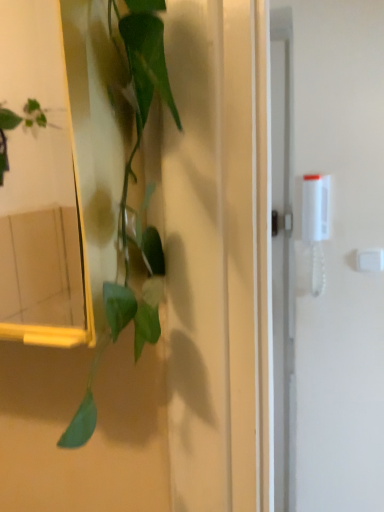
What is the approximate height of green matte plant at left?

The height of green matte plant at left is 16.72 inches.

In order to face green matte plant at left, should I rotate leftwards or rightwards?

You should look left and rotate roughly 7.533 degrees.

Image resolution: width=384 pixels, height=512 pixels. Describe the element at coordinates (143, 71) in the screenshot. I see `green matte plant at left` at that location.

Where is `green matte plant at left`? green matte plant at left is located at coordinates (143, 71).

The width and height of the screenshot is (384, 512). I want to click on white plastic light switch at upper right, so click(x=370, y=260).

Measure the distance between point [377,261] and camera.

Point [377,261] and camera are 4.62 feet apart from each other.

The width and height of the screenshot is (384, 512). Describe the element at coordinates (370, 260) in the screenshot. I see `white plastic light switch at upper right` at that location.

Where is `green matte plant at left`? This screenshot has height=512, width=384. green matte plant at left is located at coordinates (143, 71).

Which object is positioned more to the right, green matte plant at left or white plastic light switch at upper right?

Positioned to the right is white plastic light switch at upper right.

Which object is further away from the camera taking this photo, green matte plant at left or white plastic light switch at upper right?

white plastic light switch at upper right is more distant.

Considering the positions of points (139, 84) and (379, 270), is point (139, 84) farther from camera compared to point (379, 270)?

No, (139, 84) is in front of (379, 270).

From the image's perspective, is green matte plant at left beneath white plastic light switch at upper right?

Incorrect, from the image's perspective, green matte plant at left is higher than white plastic light switch at upper right.

Based on the photo, from a real-world perspective, which object stands above the other?

From a 3D spatial view, green matte plant at left is above.

In terms of width, does green matte plant at left look wider or thinner when compared to white plastic light switch at upper right?

Considering their sizes, green matte plant at left looks broader than white plastic light switch at upper right.

Considering the relative sizes of green matte plant at left and white plastic light switch at upper right in the image provided, is green matte plant at left taller than white plastic light switch at upper right?

Correct, green matte plant at left is much taller as white plastic light switch at upper right.

Can you confirm if green matte plant at left is smaller than white plastic light switch at upper right?

Actually, green matte plant at left might be larger than white plastic light switch at upper right.

Do you think green matte plant at left is within white plastic light switch at upper right, or outside of it?

green matte plant at left is spatially situated outside white plastic light switch at upper right.

Is green matte plant at left next to white plastic light switch at upper right?

No, green matte plant at left is not touching white plastic light switch at upper right.

Is green matte plant at left oriented away from white plastic light switch at upper right?

No, green matte plant at left is not facing away from white plastic light switch at upper right.

How different are the orientations of green matte plant at left and white plastic light switch at upper right in degrees?

There is a 90.6-degree angle between the facing directions of green matte plant at left and white plastic light switch at upper right.

I want to click on houseplant in front of the white plastic light switch at upper right, so click(x=143, y=71).

In the scene shown: Between white plastic light switch at upper right and green matte plant at left, which one appears on the left side from the viewer's perspective?

green matte plant at left is more to the left.

Does white plastic light switch at upper right lie behind green matte plant at left?

Yes, the depth of white plastic light switch at upper right is greater than that of green matte plant at left.

Which point is more forward, (x=370, y=265) or (x=128, y=7)?

The point (x=128, y=7) is closer to the camera.

From the image's perspective, which is below, white plastic light switch at upper right or green matte plant at left?

white plastic light switch at upper right.

From a real-world perspective, relative to green matte plant at left, is white plastic light switch at upper right vertically above or below?

In terms of real-world spatial position, white plastic light switch at upper right is below green matte plant at left.

Between white plastic light switch at upper right and green matte plant at left, which one has smaller width?

white plastic light switch at upper right.

Consider the image. Can you confirm if white plastic light switch at upper right is shorter than green matte plant at left?

Yes, white plastic light switch at upper right is shorter than green matte plant at left.

Which of these two, white plastic light switch at upper right or green matte plant at left, is bigger?

With larger size is green matte plant at left.

Is green matte plant at left a part of white plastic light switch at upper right?

No, white plastic light switch at upper right does not contain green matte plant at left.

Are white plastic light switch at upper right and green matte plant at left making contact?

No, white plastic light switch at upper right is not making contact with green matte plant at left.

Could you tell me if white plastic light switch at upper right is turned towards green matte plant at left?

Yes, white plastic light switch at upper right faces towards green matte plant at left.

Can you tell me how much white plastic light switch at upper right and green matte plant at left differ in facing direction?

There is a 90.6-degree angle between the facing directions of white plastic light switch at upper right and green matte plant at left.

How far apart are white plastic light switch at upper right and green matte plant at left?

white plastic light switch at upper right is 3.99 feet away from green matte plant at left.

Find the location of a particular element. houseplant in front of the white plastic light switch at upper right is located at coordinates (143, 71).

There is a white plastic light switch at upper right. At what (x,y) coordinates should I click in order to perform the action: click on houseplant above it (from a real-world perspective). Please return your answer as a coordinate pair (x, y). The height and width of the screenshot is (512, 384). Looking at the image, I should click on (143, 71).

This screenshot has height=512, width=384. In order to click on houseplant on the left of the white plastic light switch at upper right in this screenshot , I will do `click(143, 71)`.